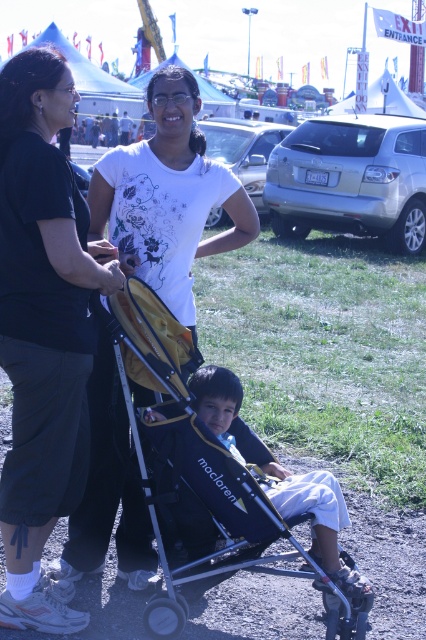
Measure the distance between black cotton shirt at upper left and black fabric shirt at center.

25.76 inches

Can you confirm if black cotton shirt at upper left is positioned to the left of black fabric shirt at center?

Correct, you'll find black cotton shirt at upper left to the left of black fabric shirt at center.

The width and height of the screenshot is (426, 640). I want to click on black cotton shirt at upper left, so click(43, 328).

Where is `black cotton shirt at upper left`? black cotton shirt at upper left is located at coordinates (43, 328).

Between black fabric shirt at center and yellow fabric stroller at center, which one is positioned higher?

black fabric shirt at center is higher up.

Does point (161, 182) come behind point (278, 492)?

Yes, it is.

What are the coordinates of `black fabric shirt at center` in the screenshot? It's located at (167, 196).

What do you see at coordinates (43, 328) in the screenshot? The width and height of the screenshot is (426, 640). I see `black cotton shirt at upper left` at bounding box center [43, 328].

Is point (28, 412) positioned behind point (152, 416)?

No, it is in front of (152, 416).

Find the location of a particular element. The width and height of the screenshot is (426, 640). black cotton shirt at upper left is located at coordinates (43, 328).